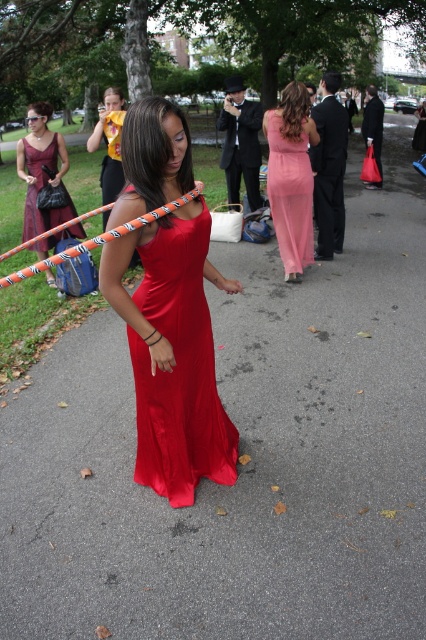
Question: Is satin dress at center positioned behind pink satin maxi dress at center?

Choices:
 (A) yes
 (B) no

Answer: (B)

Question: Among these points, which one is nearest to the camera?

Choices:
 (A) (276, 216)
 (B) (147, 445)
 (C) (340, 172)
 (D) (37, 188)

Answer: (B)

Question: Is satin dress at center below pink satin maxi dress at center?

Choices:
 (A) yes
 (B) no

Answer: (A)

Question: Which of the following is the closest to the observer?

Choices:
 (A) (17, 145)
 (B) (147, 388)
 (C) (319, 259)
 (D) (294, 228)

Answer: (B)

Question: Among these objects, which one is nearest to the camera?

Choices:
 (A) pink satin maxi dress at center
 (B) pink satin dress at upper center
 (C) matte burgundy dress at center

Answer: (B)

Question: Can you confirm if satin dress at center is positioned below matte burgundy dress at center?

Choices:
 (A) yes
 (B) no

Answer: (A)